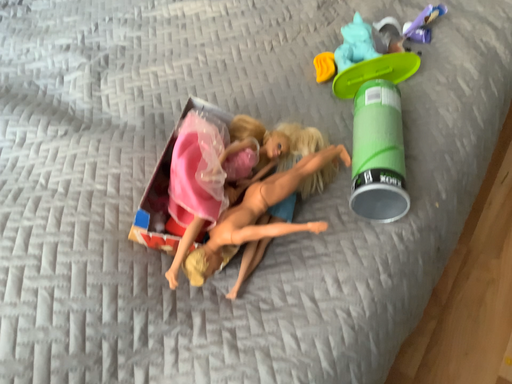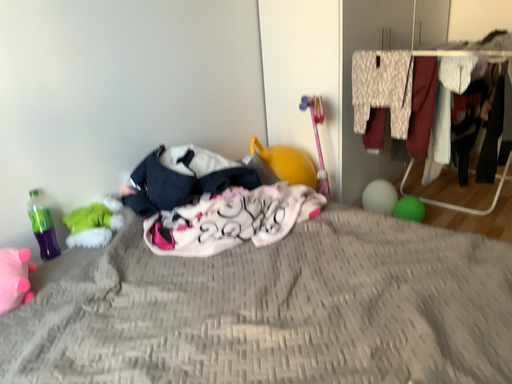
Question: Which way did the camera rotate in the video?

Choices:
 (A) rotated upward
 (B) rotated downward

Answer: (A)